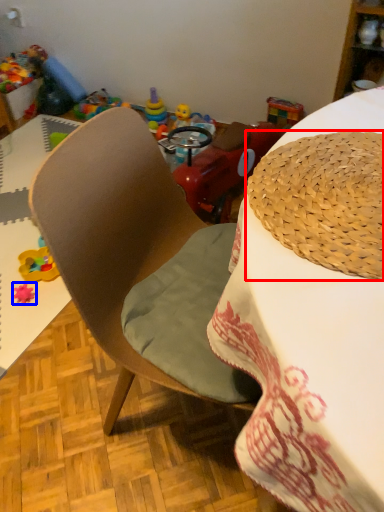
Question: Which of the following is the closest to the observer, hat (highlighted by a red box) or toy (highlighted by a blue box)?

Choices:
 (A) hat
 (B) toy

Answer: (A)